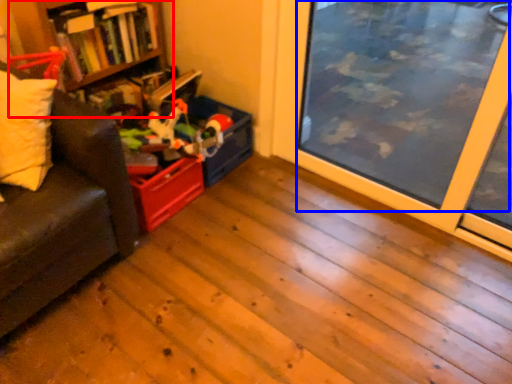
Question: Which object is closer to the camera taking this photo, bookshelf (highlighted by a red box) or window screen (highlighted by a blue box)?

Choices:
 (A) bookshelf
 (B) window screen

Answer: (B)